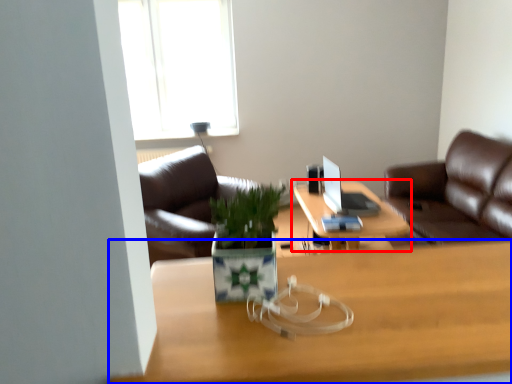
Question: Which of the following is the closest to the observer, table (highlighted by a red box) or desk (highlighted by a blue box)?

Choices:
 (A) table
 (B) desk

Answer: (B)